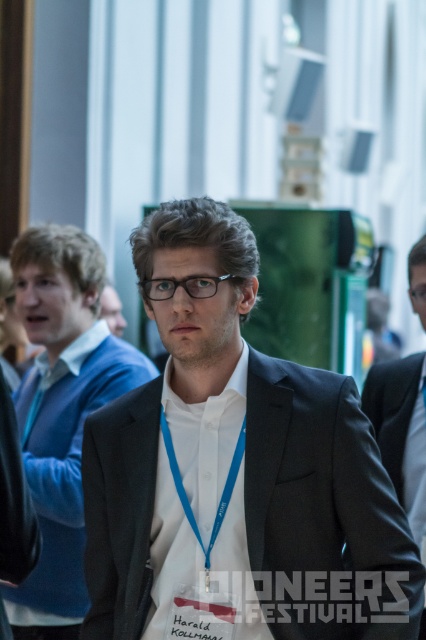
Question: Is black matte suit at center positioned behind black suit at center?

Choices:
 (A) yes
 (B) no

Answer: (B)

Question: Which object appears closest to the camera in this image?

Choices:
 (A) skinny white shirt at center
 (B) black matte suit at center
 (C) matte black suit at center

Answer: (B)

Question: Which of the following is the farthest from the observer?

Choices:
 (A) dark gray suit at center
 (B) black matte suit at center

Answer: (A)

Question: Does black matte suit at center appear on the left side of dark gray suit at center?

Choices:
 (A) no
 (B) yes

Answer: (A)

Question: Which of the following is the farthest from the observer?

Choices:
 (A) (72, 275)
 (B) (394, 406)

Answer: (A)

Question: Can you confirm if black matte suit at center is thinner than skinny white shirt at center?

Choices:
 (A) no
 (B) yes

Answer: (A)